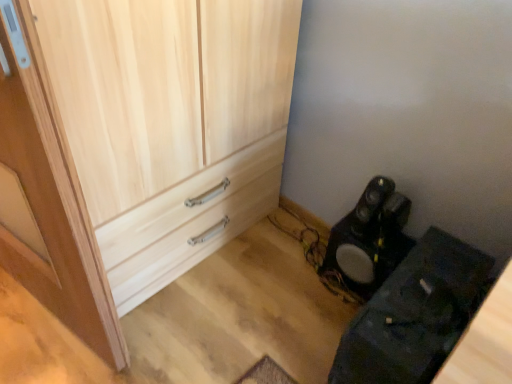
Locate an element on the screen. The height and width of the screenshot is (384, 512). free space to the left of black matte speaker at lower right is located at coordinates (303, 279).